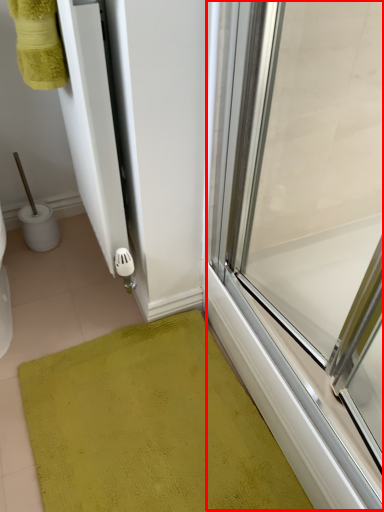
Question: From the image's perspective, considering the relative positions of glass door (annotated by the red box) and bath mat in the image provided, where is glass door (annotated by the red box) located with respect to the staircase?

Choices:
 (A) above
 (B) below

Answer: (A)